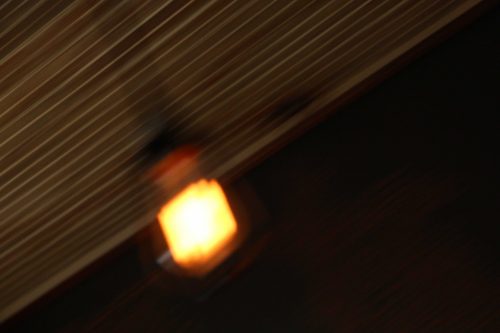
The image size is (500, 333). I want to click on light fixture attached to wall, so click(231, 258).